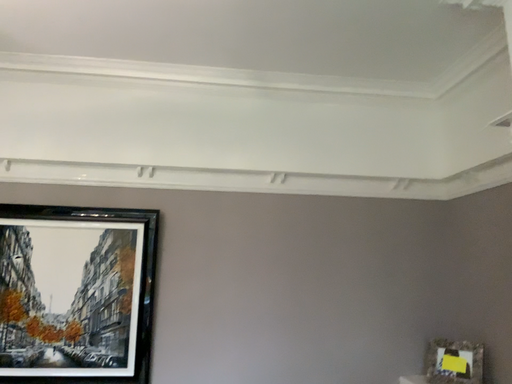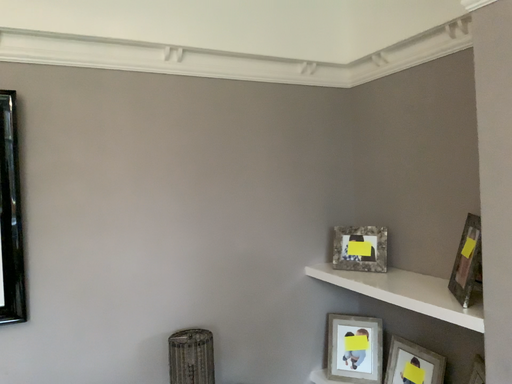
Question: How did the camera likely rotate when shooting the video?

Choices:
 (A) rotated upward
 (B) rotated downward

Answer: (B)